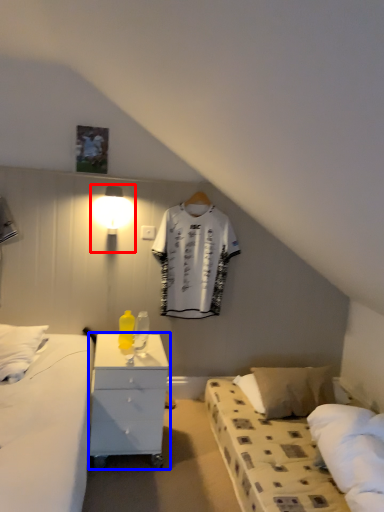
Question: Which point is further to the camera, light fixture (highlighted by a red box) or nightstand (highlighted by a blue box)?

Choices:
 (A) light fixture
 (B) nightstand

Answer: (A)